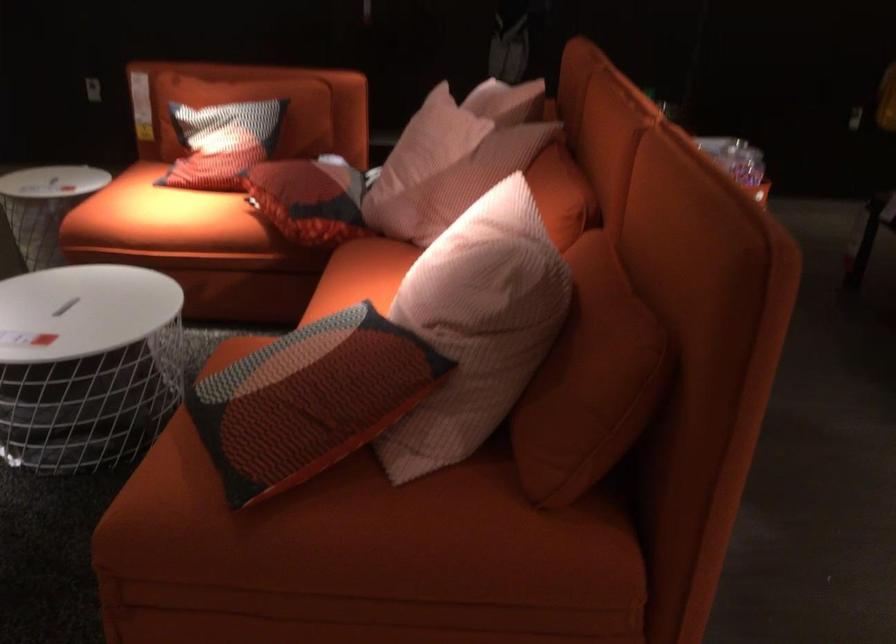
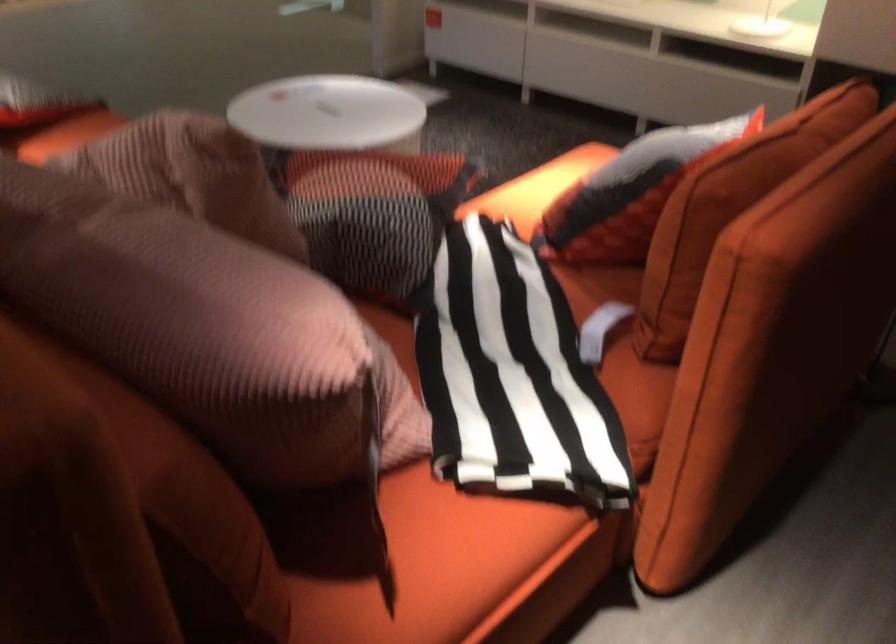
Question: I am providing you with two images of the same scene from different viewpoints. Please identify which objects are invisible in image2.

Choices:
 (A) orange sofa sitting surface
 (B) red patterned pillow
 (C) black patterned pillow
 (D) red ladder latch

Answer: (A)